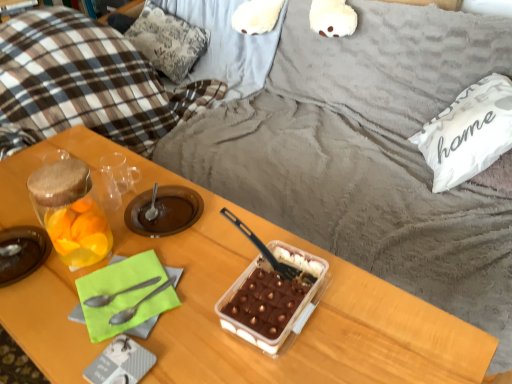
Locate an element on the screen. The width and height of the screenshot is (512, 384). space that is in front of translucent glass jar at left, the 2th snack viewed from the right is located at coordinates (47, 317).